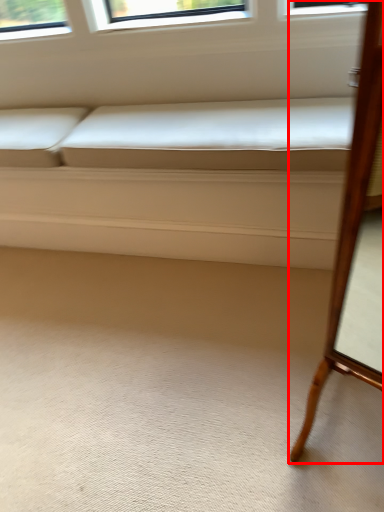
Question: From the image's perspective, where is furniture (annotated by the red box) located relative to couch?

Choices:
 (A) above
 (B) below

Answer: (B)